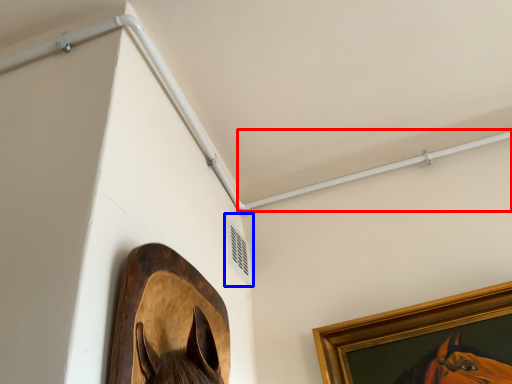
Question: Which point is closer to the camera, beam (highlighted by a red box) or air conditioning (highlighted by a blue box)?

Choices:
 (A) beam
 (B) air conditioning

Answer: (B)